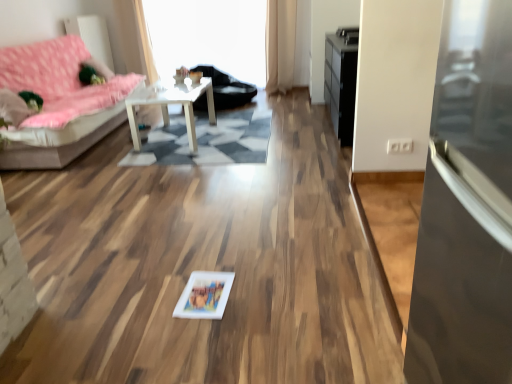
Question: Is there a large distance between black glossy dresser at upper right and transparent glass window screen at upper center?

Choices:
 (A) no
 (B) yes

Answer: (B)

Question: Is black glossy dresser at upper right at the left side of transparent glass window screen at upper center?

Choices:
 (A) no
 (B) yes

Answer: (A)

Question: Is black glossy dresser at upper right positioned with its back to transparent glass window screen at upper center?

Choices:
 (A) no
 (B) yes

Answer: (A)

Question: Can you confirm if black glossy dresser at upper right is smaller than transparent glass window screen at upper center?

Choices:
 (A) yes
 (B) no

Answer: (A)

Question: Is black glossy dresser at upper right aimed at transparent glass window screen at upper center?

Choices:
 (A) no
 (B) yes

Answer: (A)

Question: Is the position of black glossy dresser at upper right less distant than that of transparent glass window screen at upper center?

Choices:
 (A) yes
 (B) no

Answer: (A)

Question: Is pink fabric studio couch at left located outside black glossy dresser at upper right?

Choices:
 (A) yes
 (B) no

Answer: (A)

Question: Is pink fabric studio couch at left wider than black glossy dresser at upper right?

Choices:
 (A) no
 (B) yes

Answer: (B)

Question: Does pink fabric studio couch at left have a greater height compared to black glossy dresser at upper right?

Choices:
 (A) no
 (B) yes

Answer: (B)

Question: Is pink fabric studio couch at left far away from black glossy dresser at upper right?

Choices:
 (A) yes
 (B) no

Answer: (A)

Question: Does pink fabric studio couch at left lie in front of black glossy dresser at upper right?

Choices:
 (A) no
 (B) yes

Answer: (B)

Question: From the image's perspective, is pink fabric studio couch at left over black glossy dresser at upper right?

Choices:
 (A) no
 (B) yes

Answer: (A)

Question: Considering the relative sizes of transparent glass door at right and black leather armchair at center in the image provided, is transparent glass door at right thinner than black leather armchair at center?

Choices:
 (A) yes
 (B) no

Answer: (A)